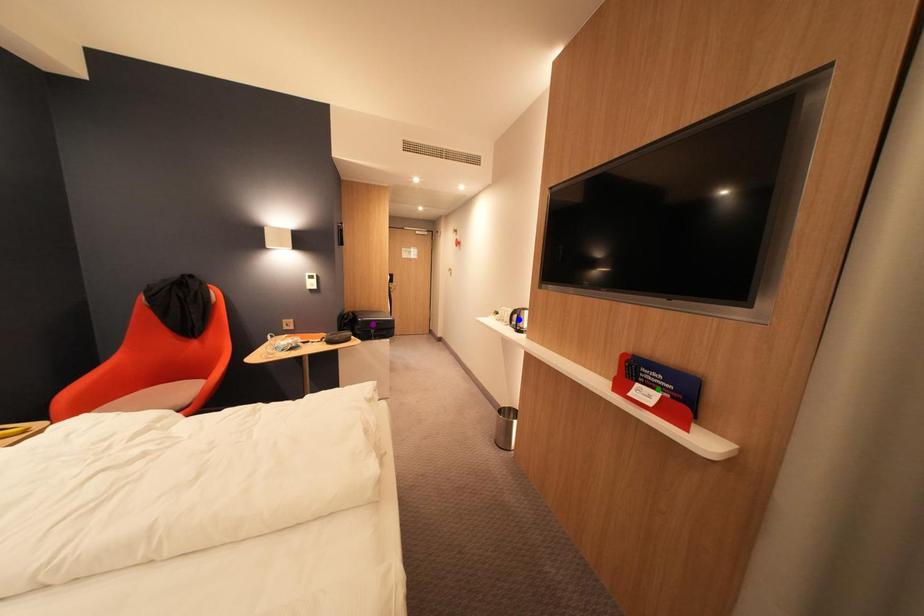
Consider the image. Order these from nearest to farthest:
purple point
blue point
green point

1. green point
2. blue point
3. purple point